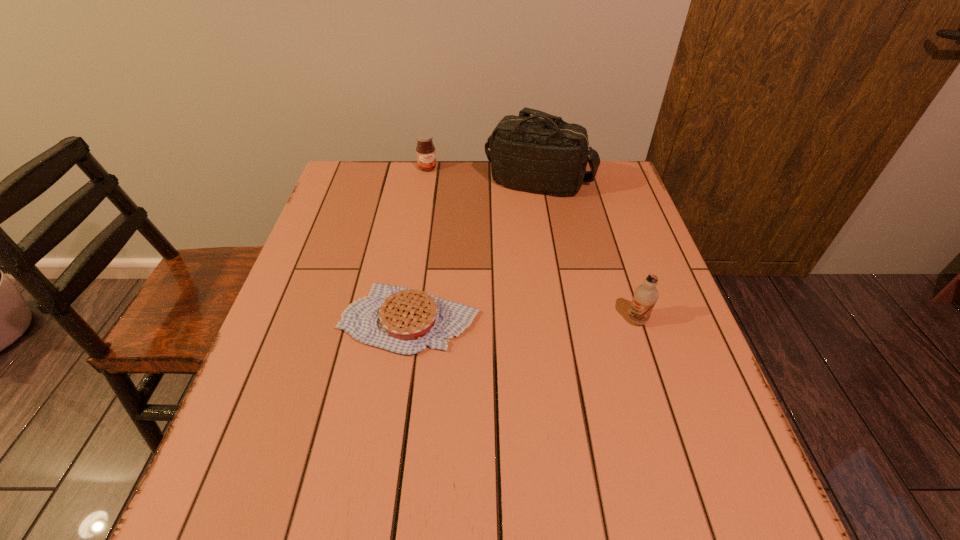
Where is `vacant space located at the front padded panel of the shoulder bag`? This screenshot has width=960, height=540. vacant space located at the front padded panel of the shoulder bag is located at coordinates (543, 253).

At what (x,y) coordinates should I click in order to perform the action: click on vacant space located 0.190m at the front padded panel of the shoulder bag. Please return your answer as a coordinate pair (x, y). The image size is (960, 540). Looking at the image, I should click on (543, 245).

Identify the location of jam located in the far edge section of the desktop. (425, 150).

This screenshot has width=960, height=540. I want to click on shoulder bag that is at the far edge, so click(x=549, y=156).

In order to click on object that is at the left edge in this screenshot , I will do `click(398, 319)`.

The height and width of the screenshot is (540, 960). Find the location of `chocolate milk situated at the right edge`. chocolate milk situated at the right edge is located at coordinates (646, 295).

Locate an element on the screen. shoulder bag located at the right edge is located at coordinates (549, 156).

Where is `object located at the far right corner`? This screenshot has height=540, width=960. object located at the far right corner is located at coordinates (549, 156).

In the image, there is a desktop. Find the location of `free space at the far edge`. free space at the far edge is located at coordinates (400, 167).

At what (x,y) coordinates should I click in order to perform the action: click on vacant space at the near edge. Please return your answer as a coordinate pair (x, y). The image size is (960, 540). Looking at the image, I should click on (401, 441).